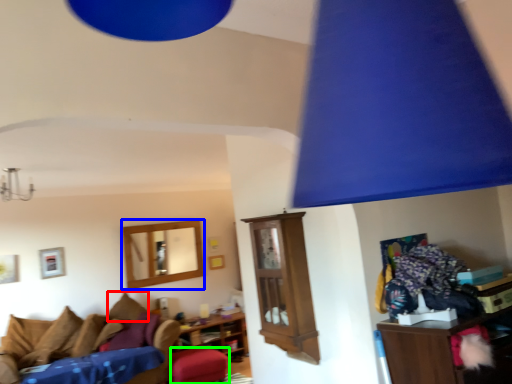
Question: Which object is positioned farthest from pillow (highlighted by a red box)? Select from picture frame (highlighted by a blue box) and stool (highlighted by a green box).

Choices:
 (A) picture frame
 (B) stool

Answer: (B)